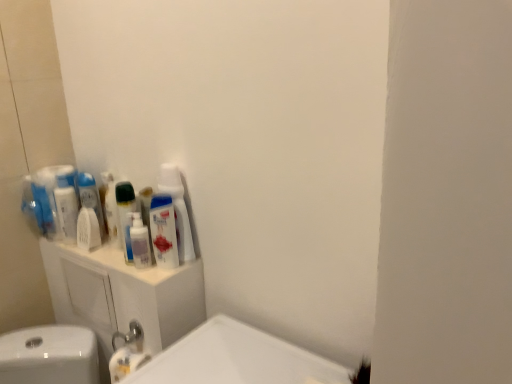
Find the location of `free space in front of white glossy mouthwash at left, which ranks as the 2th mouthwash in left-to-right order`. free space in front of white glossy mouthwash at left, which ranks as the 2th mouthwash in left-to-right order is located at coordinates (97, 254).